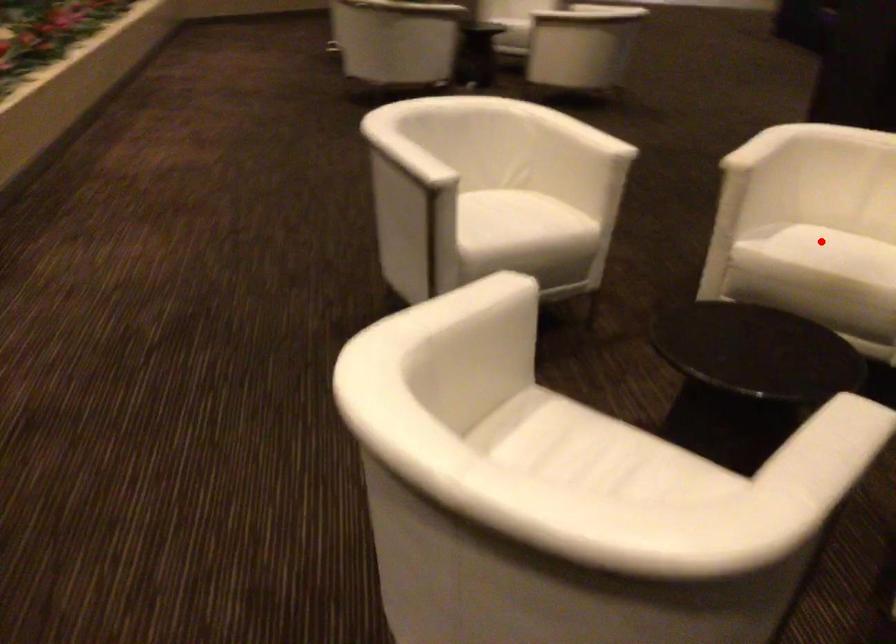
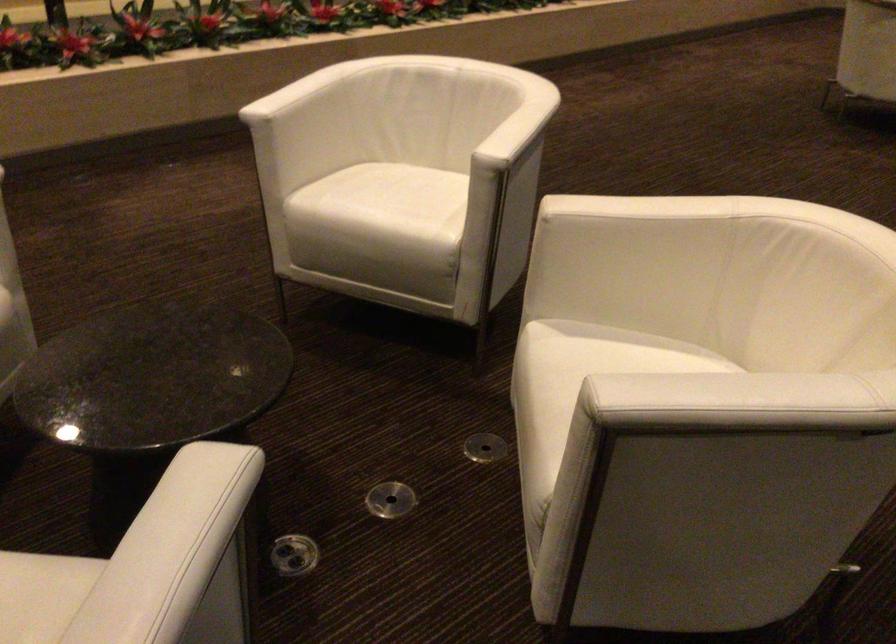
Question: I am providing you with two images of the same scene from different viewpoints. A red point is marked on the first image. Is the red point's position out of view in image 2?

Choices:
 (A) Yes
 (B) No

Answer: (B)